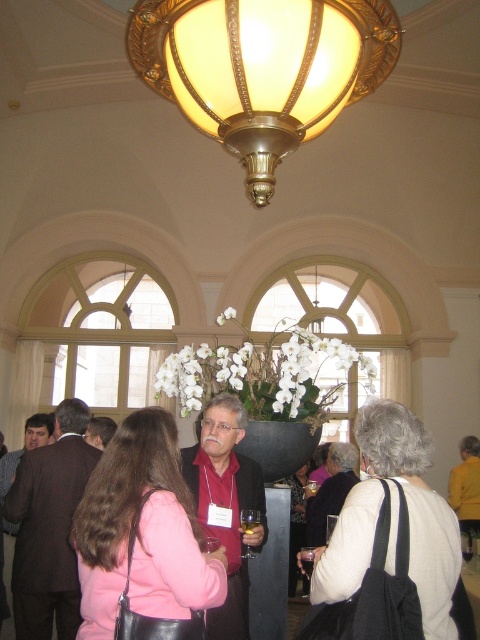
Who is more distant from viewer, (397,516) or (111,419)?

Positioned behind is point (111,419).

The height and width of the screenshot is (640, 480). Identify the location of white matte jacket at center. (388, 541).

Who is more forward, (350, 557) or (95, 429)?

Point (350, 557) is in front.

Locate an element on the screen. white matte jacket at center is located at coordinates (388, 541).

Who is positioned more to the right, matte red shirt at center or matte black dress at center?

matte black dress at center is more to the right.

Between matte red shirt at center and matte black dress at center, which one is positioned higher?

matte red shirt at center is above.

Is point (248, 472) positioned behind point (292, 481)?

No, it is not.

Locate an element on the screen. The width and height of the screenshot is (480, 640). matte red shirt at center is located at coordinates (226, 502).

Can you confirm if gold metallic lampshade at upper center is taller than matte black jacket at center?

Correct, gold metallic lampshade at upper center is much taller as matte black jacket at center.

This screenshot has height=640, width=480. Describe the element at coordinates (263, 68) in the screenshot. I see `gold metallic lampshade at upper center` at that location.

Describe the element at coordinates (263, 68) in the screenshot. I see `gold metallic lampshade at upper center` at that location.

At what (x,y) coordinates should I click in order to perform the action: click on gold metallic lampshade at upper center. Please return your answer as a coordinate pair (x, y). Looking at the image, I should click on (263, 68).